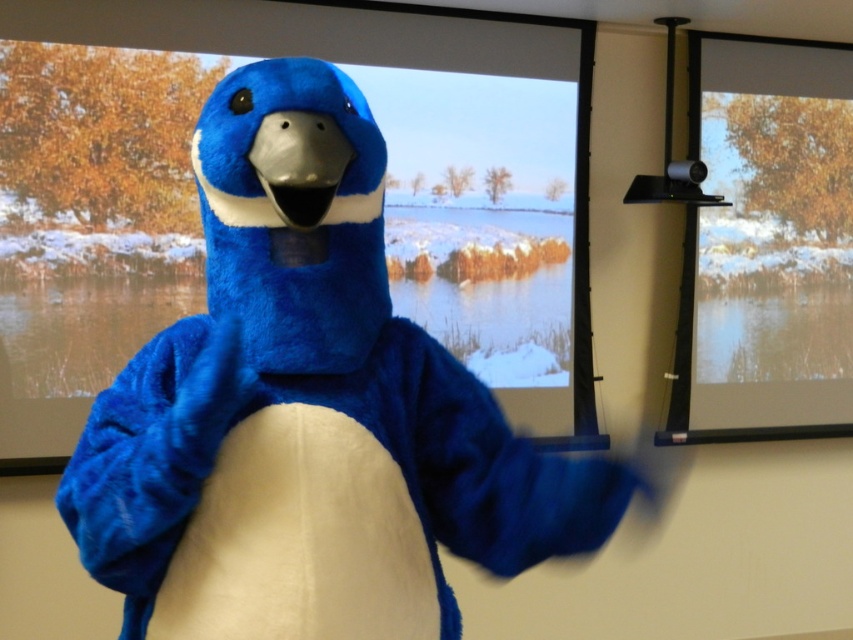
You are a security guard in the room. You notice the blue plush penguin at center and the transparent glass window at upper right. The penguin is blocking a pathway that is 10 feet wide. Can the penguin be moved to the window without obstructing the pathway?

The blue plush penguin at center is 9.66 feet away from the transparent glass window at upper right. Since the pathway is 10 feet wide, moving the penguin to the window would leave 0.34 feet of space, which is insufficient to maintain the full 10 feet width. Therefore, moving the penguin would obstruct the pathway.

You are a photographer in the room and want to capture the blue plush penguin at center in your photo. The camera has a rectangular viewfinder with a 400x400 pixel resolution. The point representing the penguin is at coordinates point (308, 412). What is the position of the blue plush penguin at center in the viewfinder?

The blue plush penguin at center is located at coordinates point (308, 412) in the viewfinder.